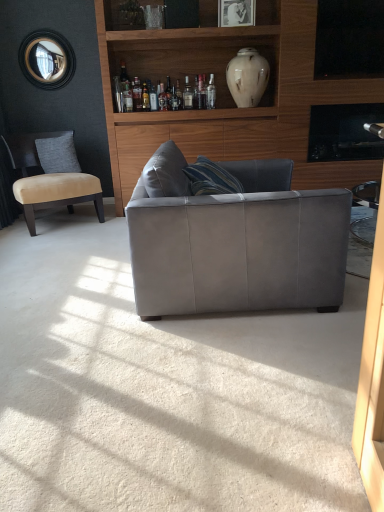
Describe the element at coordinates (51, 175) in the screenshot. I see `beige fabric chair at left` at that location.

What do you see at coordinates (118, 94) in the screenshot?
I see `clear glass bottle at center, the third bottle in the right-to-left sequence` at bounding box center [118, 94].

In order to face translucent glass bottle at upper center, which is counted as the second bottle, starting from the right, should I rotate leftwards or rightwards?

Rotate your view left by about 7.038°.

What do you see at coordinates (137, 95) in the screenshot? I see `translucent glass bottle at upper center, the 2th bottle when ordered from left to right` at bounding box center [137, 95].

Locate an element on the screen. The width and height of the screenshot is (384, 512). gray fabric pillow at left is located at coordinates (58, 154).

Where is `matte white vase at upper center`? This screenshot has height=512, width=384. matte white vase at upper center is located at coordinates (230, 96).

Is gray fabric pillow at left placed right next to black glass window screen at upper right?

No, gray fabric pillow at left is not next to black glass window screen at upper right.

Find the location of a particular element. This screenshot has height=512, width=384. window screen in front of the gray fabric pillow at left is located at coordinates (349, 39).

Is gray fabric pillow at left located outside black glass window screen at upper right?

Yes.

From the image's perspective, between gray fabric pillow at left and black glass window screen at upper right, who is located below?

gray fabric pillow at left appears lower in the image.

Can you confirm if black glass window screen at upper right is positioned to the right of suede gray couch at center?

Yes.

Is black glass window screen at upper right wider or thinner than suede gray couch at center?

Clearly, black glass window screen at upper right has less width compared to suede gray couch at center.

Image resolution: width=384 pixels, height=512 pixels. In the image, there is a black glass window screen at upper right. What are the coordinates of `studio couch below it (from a real-world perspective)` in the screenshot? It's located at (235, 241).

Considering the relative sizes of black glass window screen at upper right and suede gray couch at center in the image provided, is black glass window screen at upper right taller than suede gray couch at center?

No.

Considering the relative positions of black glass window screen at upper right and gray fabric pillow at left in the image provided, is black glass window screen at upper right to the left of gray fabric pillow at left from the viewer's perspective?

Incorrect, black glass window screen at upper right is not on the left side of gray fabric pillow at left.

Is gray fabric pillow at left located within black glass window screen at upper right?

No.

From the picture: Is black glass window screen at upper right oriented away from gray fabric pillow at left?

No, black glass window screen at upper right is not facing the opposite direction of gray fabric pillow at left.

Find the location of a particular element. The width and height of the screenshot is (384, 512). window screen above the gray fabric pillow at left (from a real-world perspective) is located at coordinates (349, 39).

Can you confirm if gray fabric pillow at left is shorter than beige fabric chair at left?

Correct, gray fabric pillow at left is not as tall as beige fabric chair at left.

You are a GUI agent. You are given a task and a screenshot of the screen. Output one action in this format:
    pyautogui.click(x=<x>, y=<y>)
    Task: Click on the chair in front of the gray fabric pillow at left
    The height and width of the screenshot is (512, 384).
    Given the screenshot: What is the action you would take?
    pyautogui.click(x=51, y=175)

Between gray fabric pillow at left and beige fabric chair at left, which one appears on the right side from the viewer's perspective?

From the viewer's perspective, gray fabric pillow at left appears more on the right side.

Is gray fabric pillow at left bigger or smaller than beige fabric chair at left?

Clearly, gray fabric pillow at left is smaller in size than beige fabric chair at left.

From the image's perspective, between beige fabric chair at left and translucent glass bottle at upper center, positioned as the 1th bottle in right-to-left order, which one is located above?

translucent glass bottle at upper center, positioned as the 1th bottle in right-to-left order.

The image size is (384, 512). In order to click on chair in front of the translucent glass bottle at upper center, positioned as the 1th bottle in right-to-left order in this screenshot , I will do `click(51, 175)`.

Is beige fabric chair at left to the left of translucent glass bottle at upper center, which appears as the third bottle when viewed from the left, from the viewer's perspective?

Yes.

From their relative heights in the image, would you say beige fabric chair at left is taller or shorter than translucent glass bottle at upper center, which appears as the third bottle when viewed from the left?

Clearly, beige fabric chair at left is taller compared to translucent glass bottle at upper center, which appears as the third bottle when viewed from the left.

Can you confirm if clear glass bottle at center, the third bottle in the right-to-left sequence, is taller than gray fabric pillow at left?

No, clear glass bottle at center, the third bottle in the right-to-left sequence, is not taller than gray fabric pillow at left.

Can you confirm if clear glass bottle at center, the third bottle in the right-to-left sequence, is thinner than gray fabric pillow at left?

Yes, clear glass bottle at center, the third bottle in the right-to-left sequence, is thinner than gray fabric pillow at left.

From a real-world perspective, is clear glass bottle at center, the third bottle in the right-to-left sequence, over gray fabric pillow at left?

Yes, from a real-world perspective, clear glass bottle at center, the third bottle in the right-to-left sequence, is above gray fabric pillow at left.

Locate an element on the screen. The image size is (384, 512). pillow on the left of white marble vase at upper center is located at coordinates (58, 154).

From a real-world perspective, is gray fabric pillow at left above or below white marble vase at upper center?

gray fabric pillow at left is situated lower than white marble vase at upper center in the real world.

Considering the relative sizes of gray fabric pillow at left and white marble vase at upper center in the image provided, is gray fabric pillow at left bigger than white marble vase at upper center?

No, gray fabric pillow at left is not bigger than white marble vase at upper center.

Is gray fabric pillow at left aimed at white marble vase at upper center?

No, gray fabric pillow at left is not facing towards white marble vase at upper center.

What are the coordinates of `pillow directly beneath the black glass window screen at upper right (from a real-world perspective)` in the screenshot? It's located at (58, 154).

Locate an element on the screen. The image size is (384, 512). window screen above the suede gray couch at center (from the image's perspective) is located at coordinates [x=349, y=39].

When comparing their distances from translucent glass bottle at upper center, which appears as the third bottle when viewed from the left, does beige fabric chair at left or gray fabric pillow at left seem further?

The object further to translucent glass bottle at upper center, which appears as the third bottle when viewed from the left, is beige fabric chair at left.

Considering their positions, is black glass window screen at upper right positioned closer to gray fabric pillow at left than translucent glass bottle at upper center, which is counted as the second bottle, starting from the right?

translucent glass bottle at upper center, which is counted as the second bottle, starting from the right, is positioned closer to the anchor gray fabric pillow at left.

Which object lies further to the anchor point white marble vase at upper center, beige fabric chair at left or suede gray couch at center?

suede gray couch at center is further to white marble vase at upper center.

Based on the photo, when comparing their distances from white marble vase at upper center, does translucent glass bottle at upper center, which appears as the third bottle when viewed from the left, or black glass window screen at upper right seem further?

black glass window screen at upper right is positioned further to the anchor white marble vase at upper center.

Estimate the real-world distances between objects in this image. Which object is further from gray fabric pillow at left, beige fabric chair at left or black glass window screen at upper right?

black glass window screen at upper right is positioned further to the anchor gray fabric pillow at left.

Looking at the image, which one is located closer to translucent glass bottle at upper center, which is counted as the second bottle, starting from the right, black glass window screen at upper right or matte white vase at upper center?

matte white vase at upper center lies closer to translucent glass bottle at upper center, which is counted as the second bottle, starting from the right, than the other object.

When comparing their distances from white marble vase at upper center, does black glass window screen at upper right or gray fabric pillow at left seem further?

Based on the image, gray fabric pillow at left appears to be further to white marble vase at upper center.

When comparing their distances from gray fabric pillow at left, does white marble vase at upper center or clear glass bottle at center, the third bottle in the right-to-left sequence, seem closer?

Based on the image, clear glass bottle at center, the third bottle in the right-to-left sequence, appears to be nearer to gray fabric pillow at left.

This screenshot has height=512, width=384. In order to click on vase between suede gray couch at center and translucent glass bottle at upper center, the 2th bottle when ordered from left to right, from front to back in this screenshot , I will do `click(247, 77)`.

The width and height of the screenshot is (384, 512). Find the location of `bottle situated between translucent glass bottle at upper center, the 2th bottle when ordered from left to right, and matte white vase at upper center from left to right`. bottle situated between translucent glass bottle at upper center, the 2th bottle when ordered from left to right, and matte white vase at upper center from left to right is located at coordinates (211, 93).

The width and height of the screenshot is (384, 512). I want to click on vase situated between gray fabric pillow at left and black glass window screen at upper right from left to right, so click(x=247, y=77).

Locate an element on the screen. The width and height of the screenshot is (384, 512). entertainment center positioned between suede gray couch at center and clear glass bottle at center, the third bottle in the right-to-left sequence, from near to far is located at coordinates (230, 96).